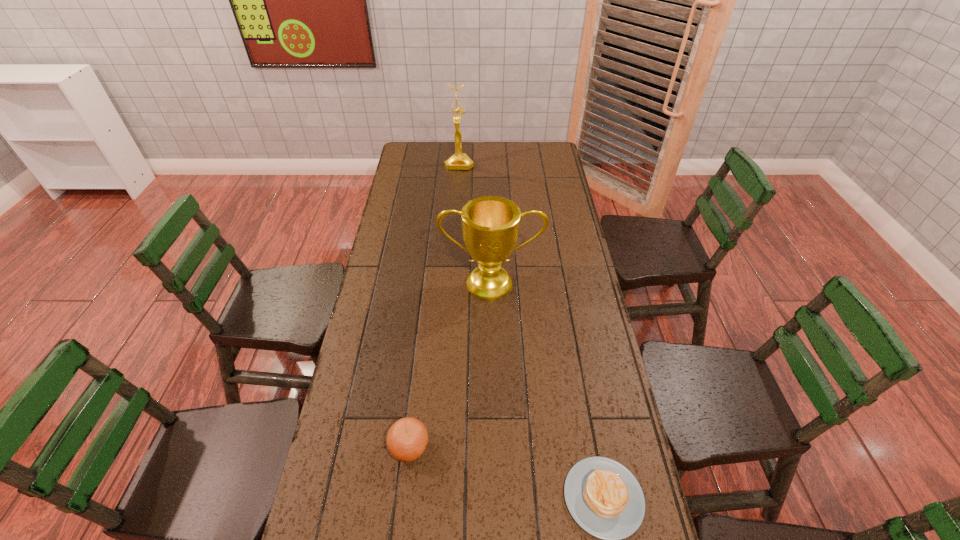
This screenshot has height=540, width=960. Identify the location of the farthest object. (459, 161).

Where is `the taller award`? This screenshot has height=540, width=960. the taller award is located at coordinates (459, 161).

At what (x,y) coordinates should I click in order to perform the action: click on the second tallest object. Please return your answer as a coordinate pair (x, y). Looking at the image, I should click on click(490, 225).

Identify the location of the nearer award. The image size is (960, 540). (490, 225).

This screenshot has height=540, width=960. What are the coordinates of `the second shortest object` in the screenshot? It's located at (407, 438).

This screenshot has width=960, height=540. In order to click on blank space located 0.100m on the front-facing side of the tallest object in this screenshot , I will do `click(458, 183)`.

Locate an element on the screen. The image size is (960, 540). free space located on the shiny surface of the second tallest object is located at coordinates (492, 362).

Where is `vacant space located on the right of the clementine`? This screenshot has height=540, width=960. vacant space located on the right of the clementine is located at coordinates (572, 447).

The height and width of the screenshot is (540, 960). I want to click on object at the far edge, so coord(459,161).

Find the location of a particular element. This screenshot has height=540, width=960. object at the left edge is located at coordinates (407, 438).